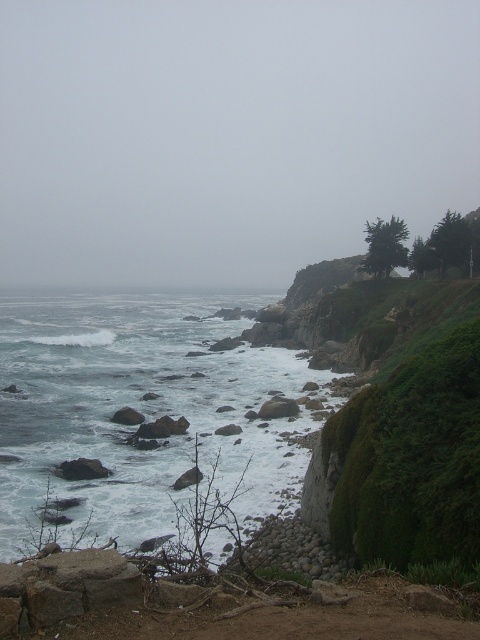
Can you confirm if foggy sky at upper center is taller than white frothy water at lower left?

Correct, foggy sky at upper center is much taller as white frothy water at lower left.

Which of these two, foggy sky at upper center or white frothy water at lower left, stands shorter?

Standing shorter between the two is white frothy water at lower left.

In order to click on foggy sky at upper center in this screenshot , I will do (x=227, y=134).

Identify the location of foggy sky at upper center. This screenshot has height=640, width=480. (227, 134).